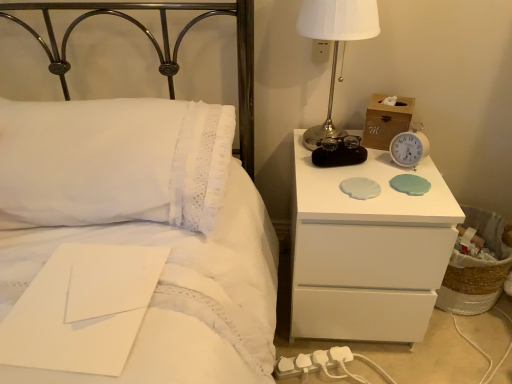
I want to click on vacant space that's between white plastic alarm clock at upper right, the 2th alarm clock viewed from the left, and white plastic alarm clock at upper right, marked as the first alarm clock in a left-to-right arrangement, so click(375, 172).